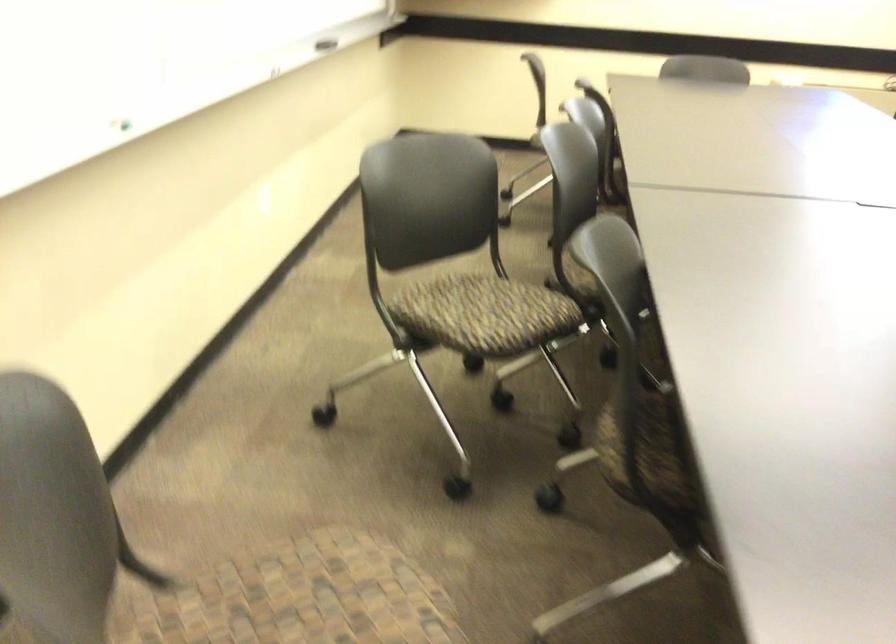
Where is `chair sitting surface`? The image size is (896, 644). chair sitting surface is located at coordinates (479, 305).